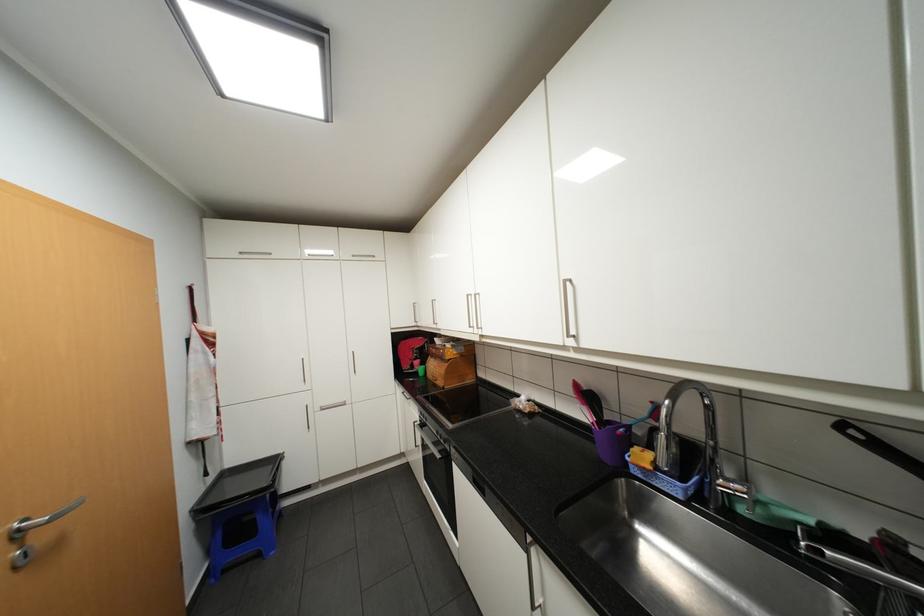
Where would you lift the wooden knife block? Please return your answer as a coordinate pair (x, y).

(451, 362)